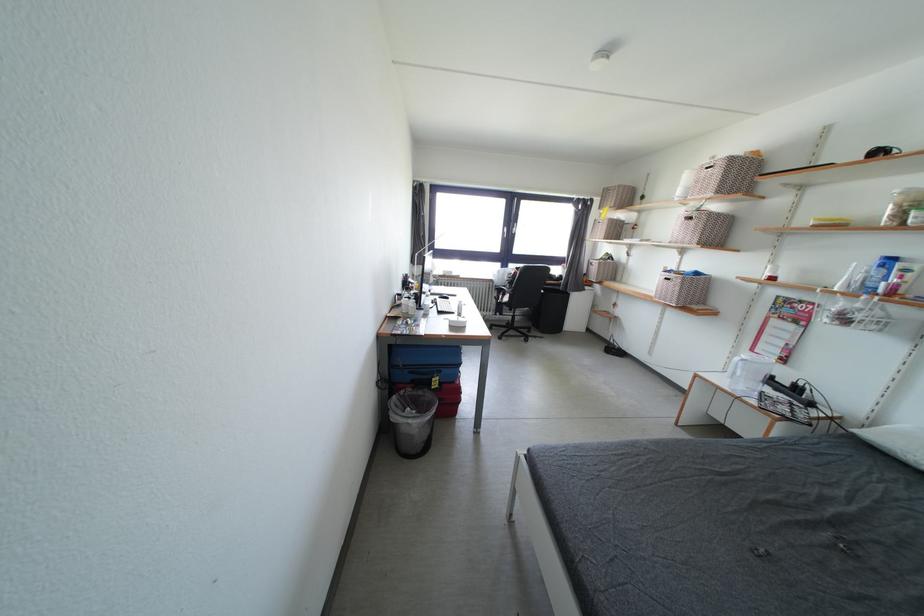
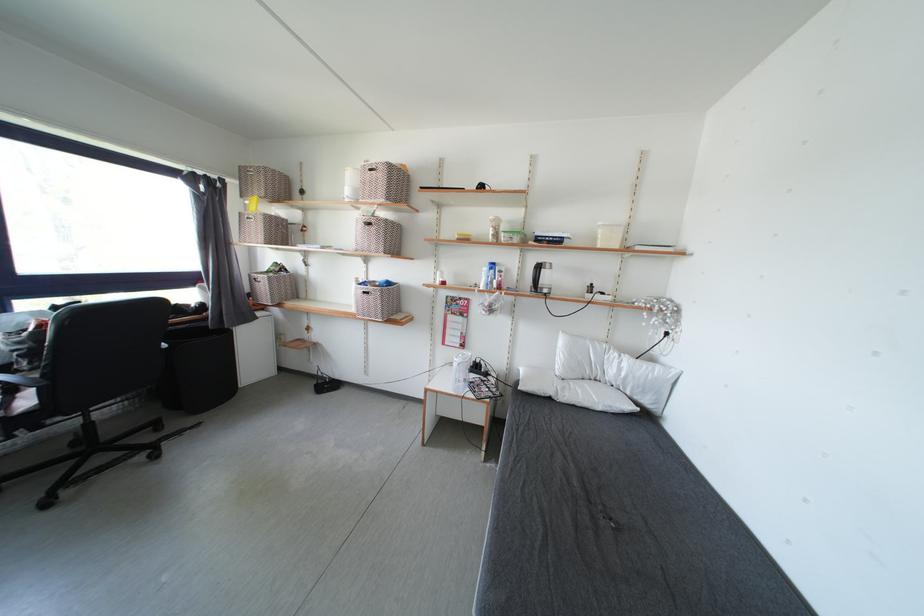
Where in the second image is the point corresponding to the point at 513,304 from the first image?

(33, 407)